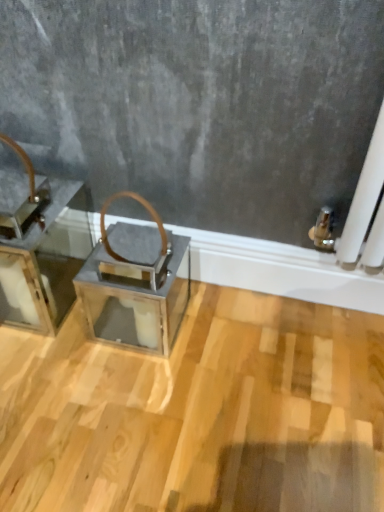
The height and width of the screenshot is (512, 384). Identify the location of vacant space underneath metallic silver tray at left (from a real-world perspective). (48, 292).